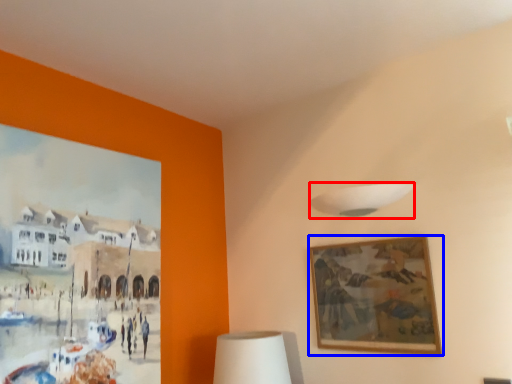
Question: Which point is further to the camera, lamp (highlighted by a red box) or picture frame (highlighted by a blue box)?

Choices:
 (A) lamp
 (B) picture frame

Answer: (A)